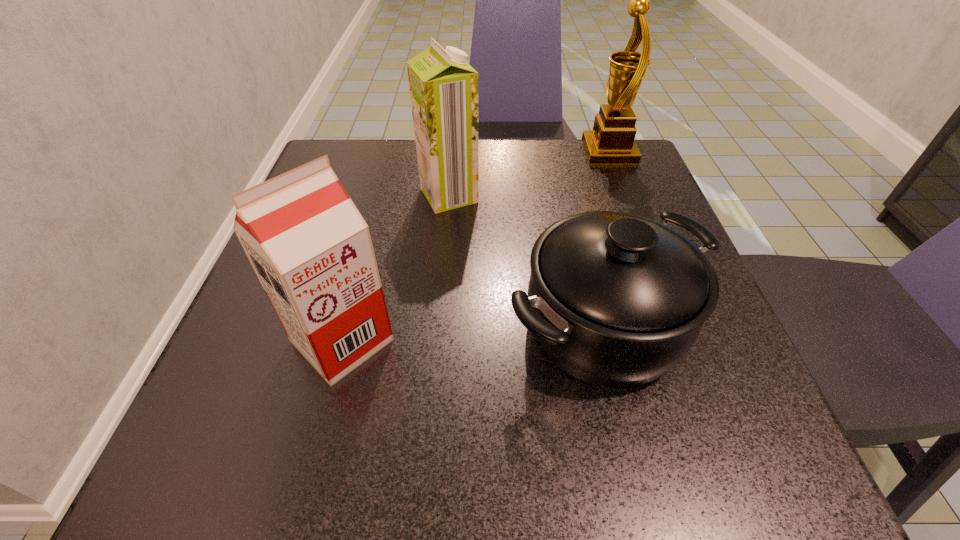
This screenshot has width=960, height=540. Identify the location of free spot between the farther soya milk and the leftmost object. (396, 268).

Locate an element on the screen. This screenshot has width=960, height=540. empty space that is in between the farther soya milk and the leftmost object is located at coordinates (396, 268).

At what (x,y) coordinates should I click in order to perform the action: click on object that can be found as the second closest to the left soya milk. Please return your answer as a coordinate pair (x, y). The height and width of the screenshot is (540, 960). Looking at the image, I should click on point(443,87).

Locate an element on the screen. object that stands as the third closest to the nearer soya milk is located at coordinates (611, 142).

Locate an element on the screen. This screenshot has width=960, height=540. free space that satisfies the following two spatial constraints: 1. on the front-facing side of the award; 2. on the front side of the second farthest object is located at coordinates [x=626, y=195].

The image size is (960, 540). I want to click on free point that satisfies the following two spatial constraints: 1. on the front-facing side of the award; 2. on the front side of the saucepan, so click(x=676, y=325).